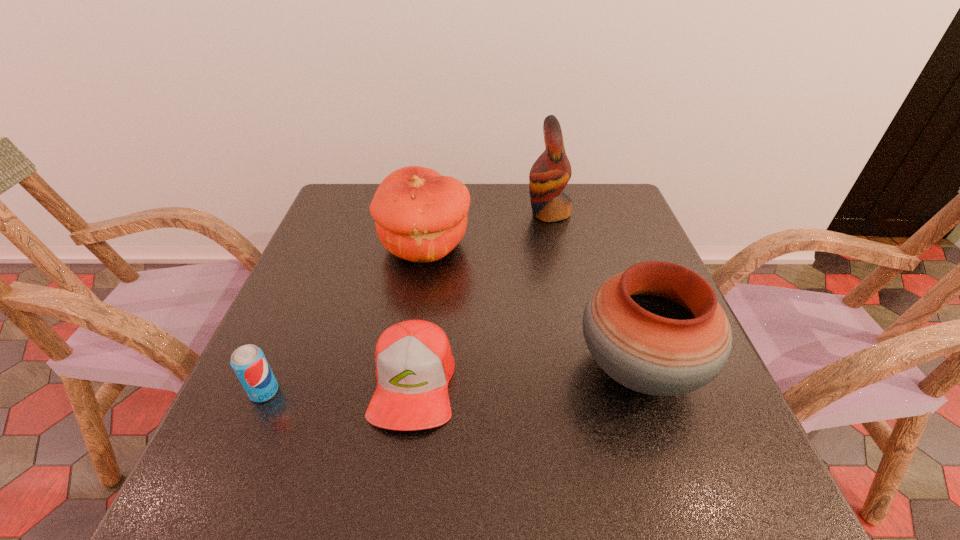
In order to click on vacant space located on the right of the soda can in this screenshot , I will do `click(376, 392)`.

Where is `vacant space located 0.050m on the front-facing side of the baseball cap`? This screenshot has width=960, height=540. vacant space located 0.050m on the front-facing side of the baseball cap is located at coordinates (402, 465).

The image size is (960, 540). In order to click on parrot situated at the far edge in this screenshot , I will do `click(551, 172)`.

Locate an element on the screen. Image resolution: width=960 pixels, height=540 pixels. pumpkin that is at the far edge is located at coordinates (420, 216).

This screenshot has width=960, height=540. Find the location of `object that is positioned at the left edge`. object that is positioned at the left edge is located at coordinates (249, 363).

Where is `object positioned at the right edge`? Image resolution: width=960 pixels, height=540 pixels. object positioned at the right edge is located at coordinates [656, 328].

I want to click on blank space at the near edge of the desktop, so click(592, 497).

Find the location of `vacant space at the left edge`. vacant space at the left edge is located at coordinates (326, 277).

This screenshot has width=960, height=540. Identify the location of vacant position at the right edge of the desktop. (601, 244).

This screenshot has height=540, width=960. In order to click on free spot at the far left corner of the desktop in this screenshot , I will do `click(336, 203)`.